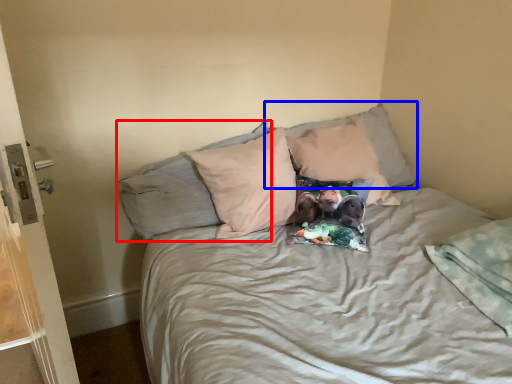
Question: Among these objects, which one is farthest to the camera, pillow (highlighted by a red box) or pillow (highlighted by a blue box)?

Choices:
 (A) pillow
 (B) pillow

Answer: (B)